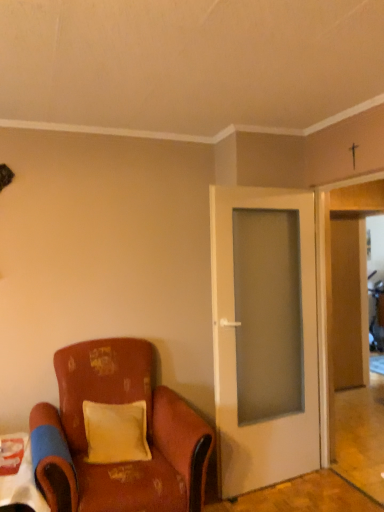
Question: Is white glass door at center far from wooden door at right?

Choices:
 (A) yes
 (B) no

Answer: (A)

Question: From a real-world perspective, is white glass door at center under wooden door at right?

Choices:
 (A) yes
 (B) no

Answer: (A)

Question: From the image's perspective, does white glass door at center appear higher than wooden door at right?

Choices:
 (A) no
 (B) yes

Answer: (A)

Question: Is white glass door at center thinner than wooden door at right?

Choices:
 (A) no
 (B) yes

Answer: (B)

Question: Could you tell me if white glass door at center is turned towards wooden door at right?

Choices:
 (A) no
 (B) yes

Answer: (B)

Question: Is white glass door at center to the left or to the right of distressed leather chair at lower left in the image?

Choices:
 (A) left
 (B) right

Answer: (B)

Question: From their relative heights in the image, would you say white glass door at center is taller or shorter than distressed leather chair at lower left?

Choices:
 (A) tall
 (B) short

Answer: (A)

Question: From the image's perspective, is white glass door at center located above or below distressed leather chair at lower left?

Choices:
 (A) below
 (B) above

Answer: (B)

Question: Is white glass door at center situated inside distressed leather chair at lower left or outside?

Choices:
 (A) inside
 (B) outside

Answer: (B)

Question: Does point (29, 471) appear closer or farther from the camera than point (241, 437)?

Choices:
 (A) farther
 (B) closer

Answer: (B)

Question: From the image's perspective, relative to white glass door at center, is white glossy table at lower left above or below?

Choices:
 (A) above
 (B) below

Answer: (B)

Question: Considering the positions of white glossy table at lower left and white glass door at center in the image, is white glossy table at lower left wider or thinner than white glass door at center?

Choices:
 (A) wide
 (B) thin

Answer: (A)

Question: Is white glossy table at lower left inside or outside of white glass door at center?

Choices:
 (A) outside
 (B) inside

Answer: (A)

Question: Looking at the image, does white glass door at center seem bigger or smaller compared to white glossy table at lower left?

Choices:
 (A) big
 (B) small

Answer: (A)

Question: Which is correct: white glass door at center is inside white glossy table at lower left, or outside of it?

Choices:
 (A) outside
 (B) inside

Answer: (A)